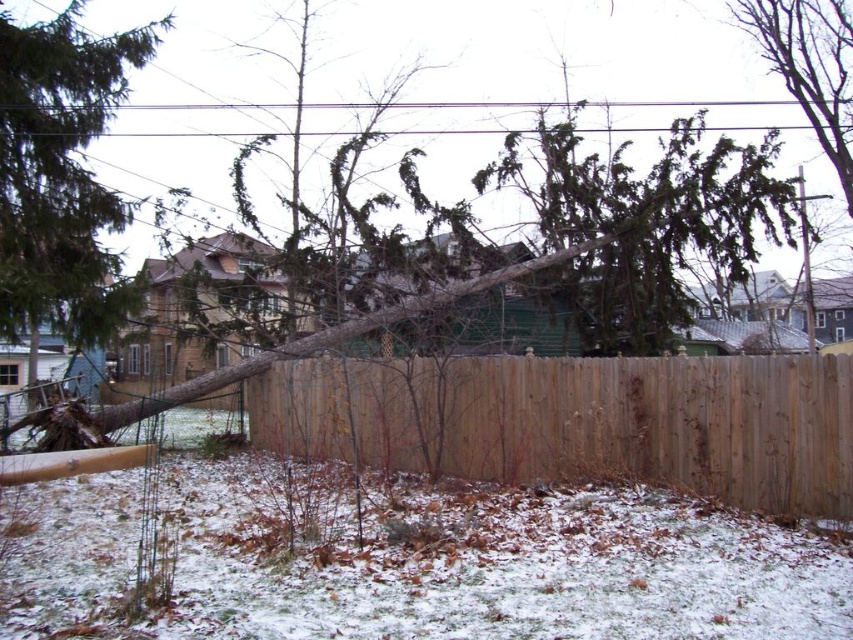
Who is more distant from viewer, [836,372] or [811,45]?

Positioned behind is point [811,45].

How much distance is there between brown wood fence at center and bare wood tree at upper right?

brown wood fence at center is 18.01 meters from bare wood tree at upper right.

Identify the location of brown wood fence at center. (579, 420).

At what (x,y) coordinates should I click in order to perform the action: click on brown wood fence at center. Please return your answer as a coordinate pair (x, y). The width and height of the screenshot is (853, 640). Looking at the image, I should click on (579, 420).

Does brown wood fence at center have a lesser height compared to green needle-like tree at left?

Incorrect, brown wood fence at center's height does not fall short of green needle-like tree at left's.

Identify the location of brown wood fence at center. (579, 420).

Is point (409, 372) farther from viewer compared to point (32, 156)?

No, it is in front of (32, 156).

What are the coordinates of `brown wood fence at center` in the screenshot? It's located at (579, 420).

Which is more to the right, green needle-like tree at left or bare wood tree at upper right?

bare wood tree at upper right is more to the right.

Where is `green needle-like tree at left`? This screenshot has height=640, width=853. green needle-like tree at left is located at coordinates (61, 173).